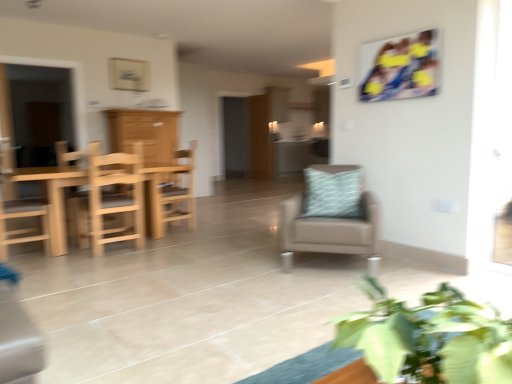
Question: Is green leafy plant at lower right next to suede beige chair at center, the 4th chair when ordered from left to right?

Choices:
 (A) yes
 (B) no

Answer: (B)

Question: Is green leafy plant at lower right smaller than suede beige chair at center, the 4th chair when ordered from left to right?

Choices:
 (A) yes
 (B) no

Answer: (A)

Question: Is green leafy plant at lower right taller than suede beige chair at center, arranged as the 1th chair when viewed from the right?

Choices:
 (A) no
 (B) yes

Answer: (A)

Question: Is green leafy plant at lower right in front of suede beige chair at center, arranged as the 1th chair when viewed from the right?

Choices:
 (A) no
 (B) yes

Answer: (B)

Question: Are green leafy plant at lower right and suede beige chair at center, arranged as the 1th chair when viewed from the right, located far from each other?

Choices:
 (A) yes
 (B) no

Answer: (A)

Question: From the image's perspective, is green leafy plant at lower right above suede beige chair at center, the 4th chair when ordered from left to right?

Choices:
 (A) no
 (B) yes

Answer: (A)

Question: From a real-world perspective, is light brown wooden chair at left, the 4th chair positioned from the right, physically above suede beige chair at center, the 4th chair when ordered from left to right?

Choices:
 (A) yes
 (B) no

Answer: (A)

Question: Can you confirm if light brown wooden chair at left, the 4th chair positioned from the right, is bigger than suede beige chair at center, the 4th chair when ordered from left to right?

Choices:
 (A) no
 (B) yes

Answer: (A)

Question: Can you confirm if light brown wooden chair at left, arranged as the 1th chair when viewed from the left, is positioned to the left of suede beige chair at center, arranged as the 1th chair when viewed from the right?

Choices:
 (A) yes
 (B) no

Answer: (A)

Question: Could you tell me if light brown wooden chair at left, arranged as the 1th chair when viewed from the left, is facing suede beige chair at center, the 4th chair when ordered from left to right?

Choices:
 (A) yes
 (B) no

Answer: (B)

Question: Can you confirm if light brown wooden chair at left, arranged as the 1th chair when viewed from the left, is thinner than suede beige chair at center, the 4th chair when ordered from left to right?

Choices:
 (A) no
 (B) yes

Answer: (B)

Question: From a real-world perspective, is light brown wooden chair at left, arranged as the 1th chair when viewed from the left, positioned under suede beige chair at center, arranged as the 1th chair when viewed from the right, based on gravity?

Choices:
 (A) yes
 (B) no

Answer: (B)

Question: From a real-world perspective, is wooden table at left physically below wooden door at center?

Choices:
 (A) no
 (B) yes

Answer: (A)